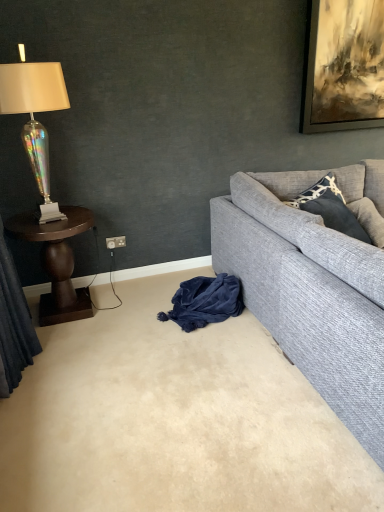
Question: Would you say dark wood side table at left is part of iridescent glass lamp at left's contents?

Choices:
 (A) no
 (B) yes

Answer: (A)

Question: From a real-world perspective, is iridescent glass lamp at left on top of dark wood side table at left?

Choices:
 (A) yes
 (B) no

Answer: (A)

Question: Considering the relative sizes of iridescent glass lamp at left and dark wood side table at left in the image provided, is iridescent glass lamp at left bigger than dark wood side table at left?

Choices:
 (A) no
 (B) yes

Answer: (A)

Question: Does iridescent glass lamp at left appear on the left side of dark wood side table at left?

Choices:
 (A) no
 (B) yes

Answer: (B)

Question: Is iridescent glass lamp at left at the right side of dark wood side table at left?

Choices:
 (A) no
 (B) yes

Answer: (A)

Question: In the image, is iridescent fabric curtain at left positioned in front of or behind iridescent glass lamp at left?

Choices:
 (A) behind
 (B) front

Answer: (B)

Question: Which is correct: iridescent fabric curtain at left is inside iridescent glass lamp at left, or outside of it?

Choices:
 (A) outside
 (B) inside

Answer: (A)

Question: From a real-world perspective, is iridescent fabric curtain at left physically located above or below iridescent glass lamp at left?

Choices:
 (A) above
 (B) below

Answer: (B)

Question: Is iridescent fabric curtain at left taller or shorter than iridescent glass lamp at left?

Choices:
 (A) short
 (B) tall

Answer: (B)

Question: Is velvet blue blanket at lower center wider or thinner than dark wood side table at left?

Choices:
 (A) thin
 (B) wide

Answer: (A)

Question: Considering the positions of point (215, 309) and point (54, 306), is point (215, 309) closer or farther from the camera than point (54, 306)?

Choices:
 (A) farther
 (B) closer

Answer: (B)

Question: From the image's perspective, relative to dark wood side table at left, is velvet blue blanket at lower center above or below?

Choices:
 (A) above
 (B) below

Answer: (B)

Question: From their relative heights in the image, would you say velvet blue blanket at lower center is taller or shorter than dark wood side table at left?

Choices:
 (A) tall
 (B) short

Answer: (B)

Question: Considering the relative positions of dark wood side table at left and iridescent fabric curtain at left in the image provided, is dark wood side table at left to the left or to the right of iridescent fabric curtain at left?

Choices:
 (A) right
 (B) left

Answer: (A)

Question: From the image's perspective, is dark wood side table at left located above or below iridescent fabric curtain at left?

Choices:
 (A) below
 (B) above

Answer: (A)